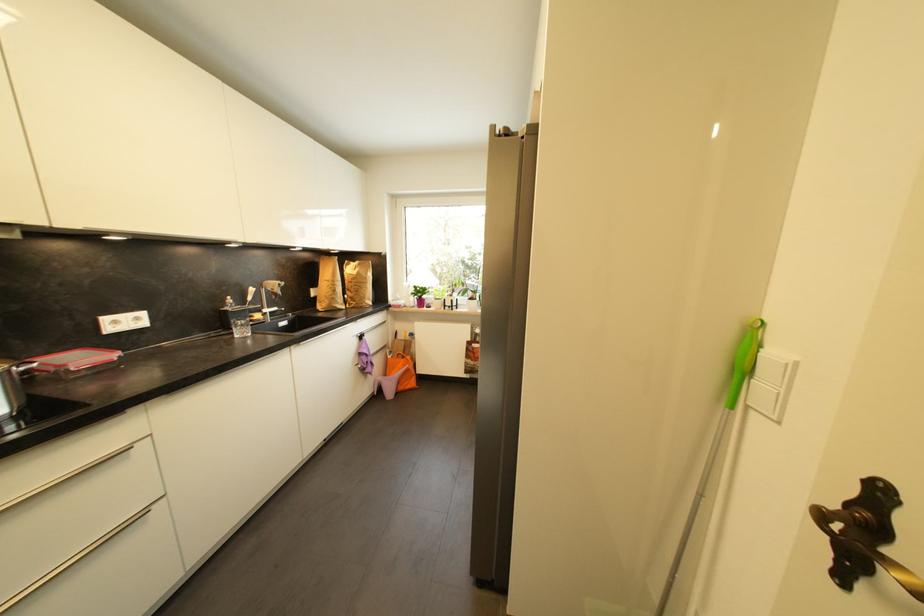
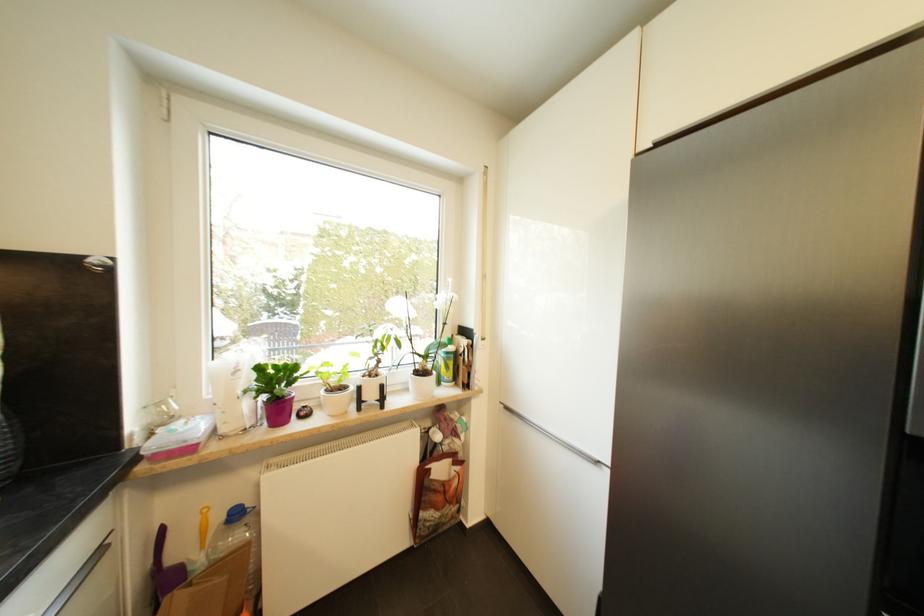
The point at (405,309) is marked in the first image. Where is the corresponding point in the second image?

(195, 451)